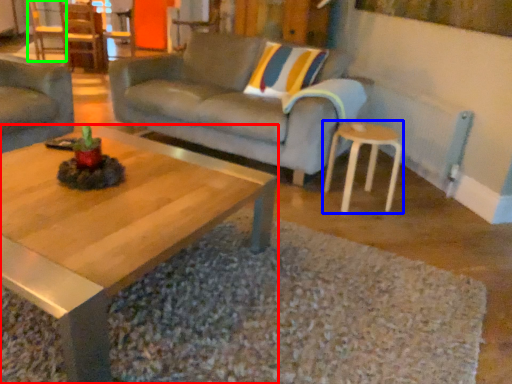
Question: Estimate the real-world distances between objects in this image. Which object is farther from coffee table (highlighted by a red box), stool (highlighted by a blue box) or chair (highlighted by a green box)?

Choices:
 (A) stool
 (B) chair

Answer: (B)